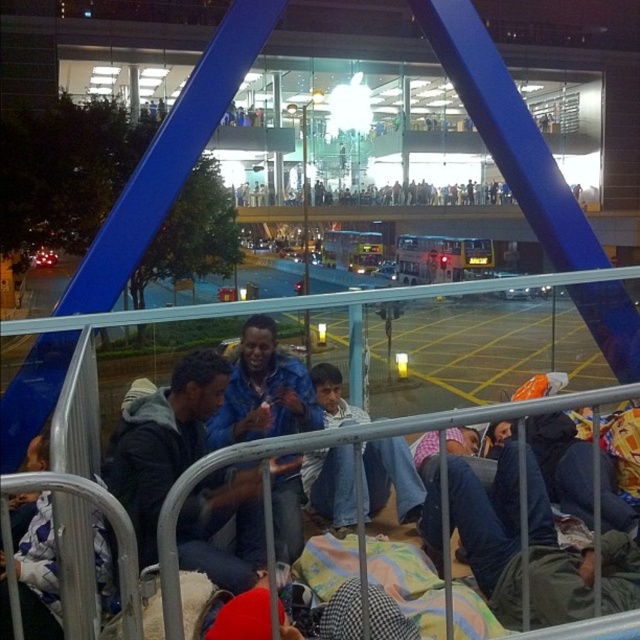
You are standing behind the metal railing in the scene and want to find the blue denim jacket at center. According to the coordinates provided, where exactly is the blue denim jacket positioned in relation to the railing?

The blue denim jacket at center is located at coordinates point (x=163, y=442), which means it is positioned approximately 69.1 percent from the left edge and 25.5 percent from the bottom edge of the image, placing it in the central area relative to the metal railing in the foreground.

You are a photographer standing behind a metal railing, trying to capture a person wearing both a blue denim jacket at center and jeans at center. Which item of clothing will appear taller in your photo?

The blue denim jacket at center appears taller than the jeans at center in the photo because the description states that the blue denim jacket at center has a greater height compared to the jeans at center.